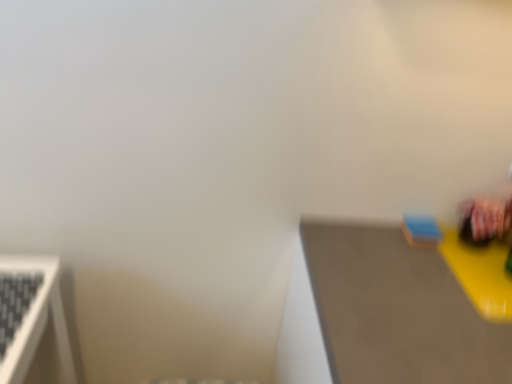
Image resolution: width=512 pixels, height=384 pixels. I want to click on free spot above smooth gray table at right (from a real-world perspective), so click(x=430, y=281).